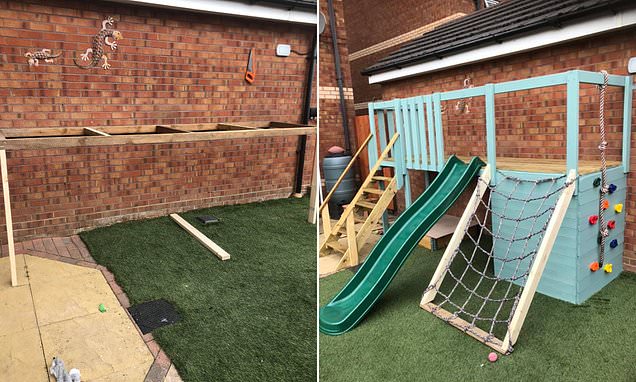
Where is `door`? The width and height of the screenshot is (636, 382). door is located at coordinates (364, 127).